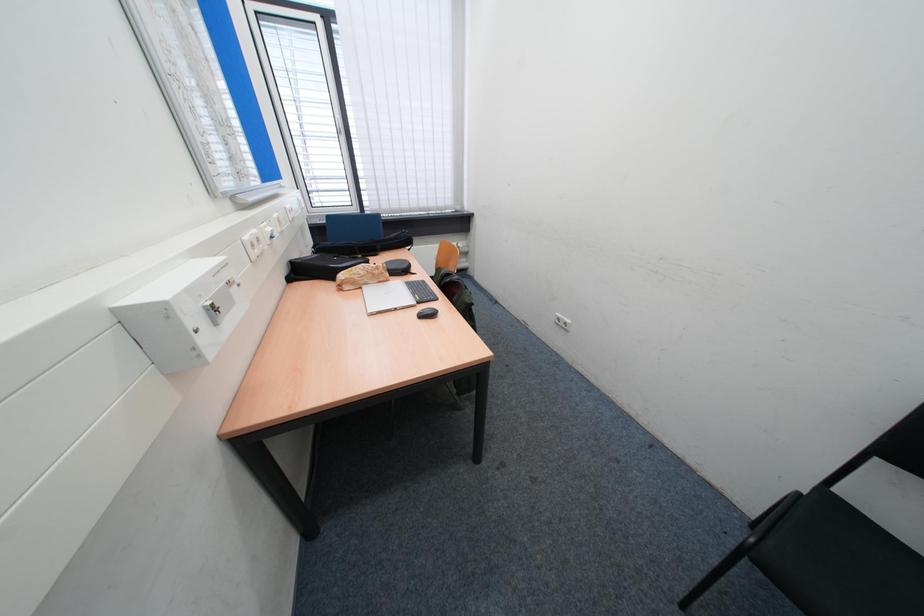
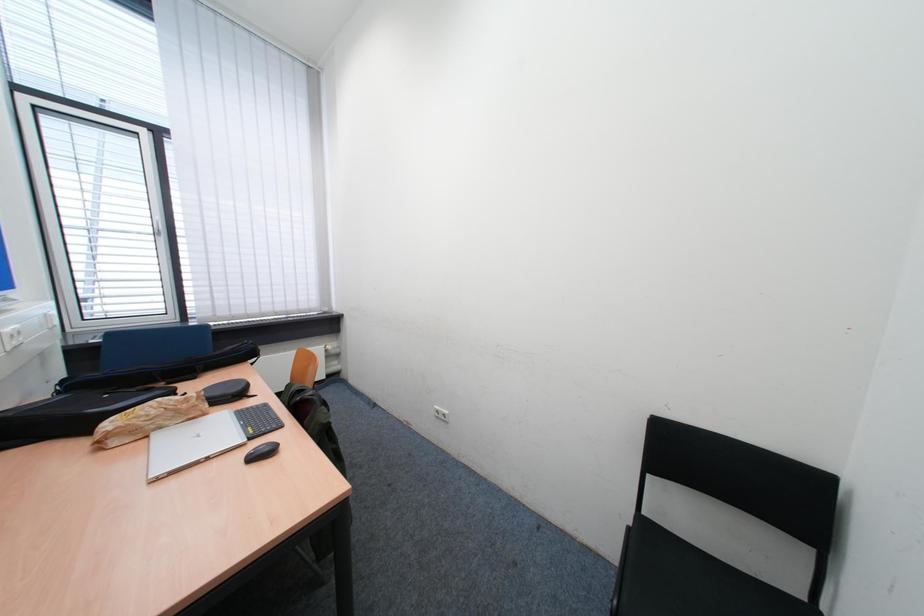
Based on the continuous images, in which direction is the camera rotating?

The camera rotated toward right-up.